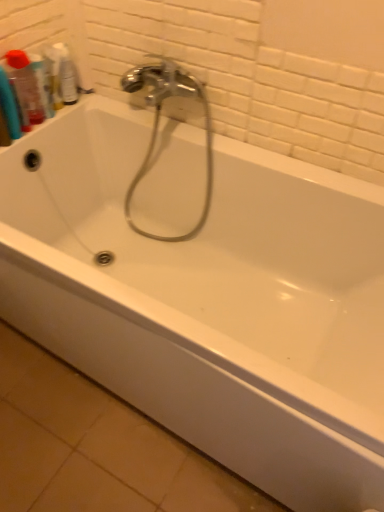
Question: Is clear plastic bottle at upper left, which is counted as the 3th mouthwash, starting from the left, positioned beyond the bounds of chrome metallic faucet at center?

Choices:
 (A) no
 (B) yes

Answer: (B)

Question: Is clear plastic bottle at upper left, which is counted as the 3th mouthwash, starting from the left, thinner than chrome metallic faucet at center?

Choices:
 (A) yes
 (B) no

Answer: (A)

Question: Is clear plastic bottle at upper left, marked as the first mouthwash in a right-to-left arrangement, to the right of chrome metallic faucet at center from the viewer's perspective?

Choices:
 (A) no
 (B) yes

Answer: (A)

Question: Is chrome metallic faucet at center surrounded by clear plastic bottle at upper left, which is counted as the 3th mouthwash, starting from the left?

Choices:
 (A) yes
 (B) no

Answer: (B)

Question: Considering the relative sizes of clear plastic bottle at upper left, which is counted as the 3th mouthwash, starting from the left, and chrome metallic faucet at center in the image provided, is clear plastic bottle at upper left, which is counted as the 3th mouthwash, starting from the left, smaller than chrome metallic faucet at center?

Choices:
 (A) no
 (B) yes

Answer: (B)

Question: From the image's perspective, does clear plastic bottle at upper left, which is counted as the 3th mouthwash, starting from the left, appear higher than chrome metallic faucet at center?

Choices:
 (A) no
 (B) yes

Answer: (B)

Question: Does translucent plastic mouthwash at upper left, the 3th mouthwash in the right-to-left sequence, have a larger size compared to clear plastic bottle at upper left, marked as the first mouthwash in a right-to-left arrangement?

Choices:
 (A) no
 (B) yes

Answer: (B)

Question: Is translucent plastic mouthwash at upper left, which ranks as the first mouthwash in left-to-right order, located outside clear plastic bottle at upper left, marked as the first mouthwash in a right-to-left arrangement?

Choices:
 (A) no
 (B) yes

Answer: (B)

Question: Would you say clear plastic bottle at upper left, marked as the first mouthwash in a right-to-left arrangement, is part of translucent plastic mouthwash at upper left, which ranks as the first mouthwash in left-to-right order,'s contents?

Choices:
 (A) yes
 (B) no

Answer: (B)

Question: From the image's perspective, is translucent plastic mouthwash at upper left, which ranks as the first mouthwash in left-to-right order, above clear plastic bottle at upper left, marked as the first mouthwash in a right-to-left arrangement?

Choices:
 (A) no
 (B) yes

Answer: (A)

Question: From a real-world perspective, is translucent plastic mouthwash at upper left, the 3th mouthwash in the right-to-left sequence, on top of clear plastic bottle at upper left, marked as the first mouthwash in a right-to-left arrangement?

Choices:
 (A) yes
 (B) no

Answer: (A)

Question: Can you confirm if translucent plastic mouthwash at upper left, the 3th mouthwash in the right-to-left sequence, is thinner than clear plastic bottle at upper left, marked as the first mouthwash in a right-to-left arrangement?

Choices:
 (A) no
 (B) yes

Answer: (A)

Question: Is translucent plastic mouthwash at upper left, which ranks as the first mouthwash in left-to-right order, located outside translucent plastic mouthwash at upper left, arranged as the 2th mouthwash when viewed from the left?

Choices:
 (A) yes
 (B) no

Answer: (A)